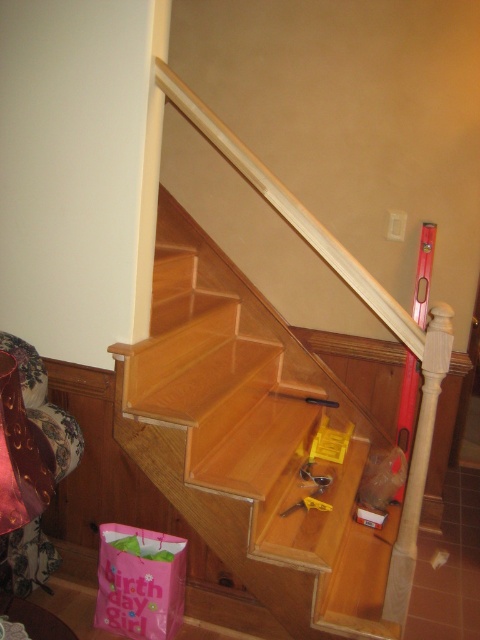
You are a construction worker who just arrived at the site and see the wooden at upper center and the yellow plastic tool at center. Which object is located above the other?

The wooden at upper center is positioned over the yellow plastic tool at center.